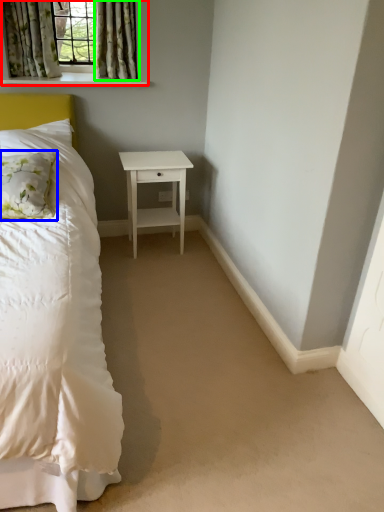
Question: Based on their relative distances, which object is nearer to window (highlighted by a red box)? Choose from pillow (highlighted by a blue box) and curtain (highlighted by a green box).

Choices:
 (A) pillow
 (B) curtain

Answer: (B)